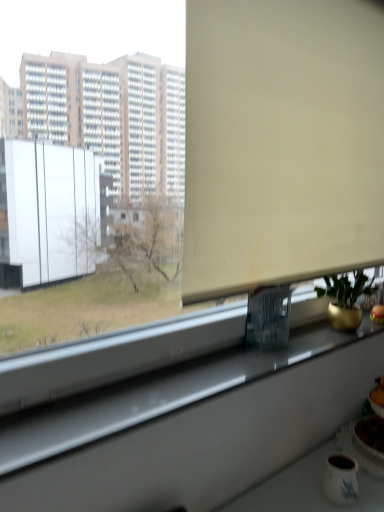
At what (x,y) coordinates should I click in order to perform the action: click on free space to the left of gold metallic pot at right. Please return your answer as a coordinate pair (x, y). The height and width of the screenshot is (512, 384). Looking at the image, I should click on (306, 337).